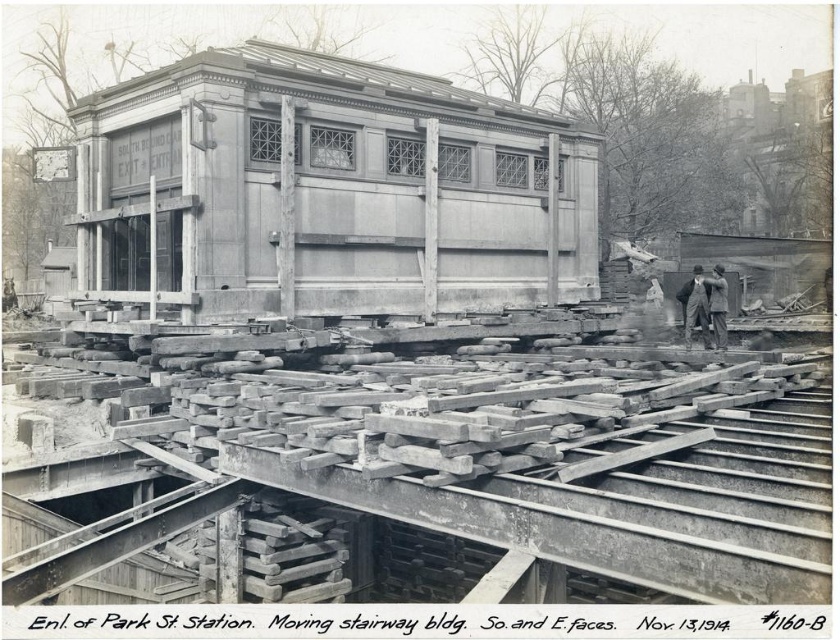
You are an observer standing at the construction site of Park Street Station. You see the wooden planks at center and the dark gray suit at center. Which object takes up more space in the image?

The wooden planks at center is bigger than dark gray suit at center, so the wooden planks at center takes up more space in the image.

Based on the scene at Park Street Station, if you were to place a 3 meter wide crate between the wooden planks at center and the wooden structure at center, would there be enough space?

The wooden planks at center are wider than the wooden structure at center, but the exact dimensions aren

In the historical image of Park Street Station from 1914, you see a wooden planks at center and a dark gray suit at center. From the perspective of someone standing at the entrance of the SOUTH ROUND CAR EXIT ENTRANCE building, which object is positioned to the left?

The wooden planks at center is to the left of dark gray suit at center, so from the entrance perspective, the wooden planks at center would be on the left side.